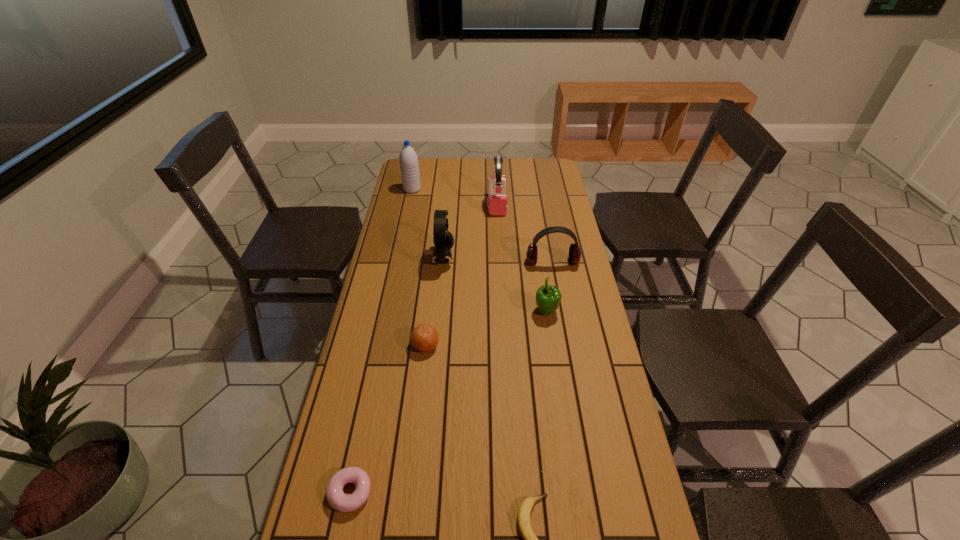
Image resolution: width=960 pixels, height=540 pixels. Identify the location of vacant area between the fourth nearest object and the second earphone from left to right. (521, 258).

Where is `vacant point located between the third nearest object and the leftmost earphone`? vacant point located between the third nearest object and the leftmost earphone is located at coordinates (434, 302).

The width and height of the screenshot is (960, 540). I want to click on the fifth closest object to the doughnut, so click(x=574, y=251).

Choose which object is the second nearest neighbor to the sixth farthest object. Please provide its 2D coordinates. Your answer should be formatted as a tuple, i.e. [(x, y)], where the tuple contains the x and y coordinates of a point satisfying the conditions above.

[(548, 297)]

Where is `the second closest earphone to the water bottle`? This screenshot has height=540, width=960. the second closest earphone to the water bottle is located at coordinates (443, 240).

Identify the location of earphone that is the second closest to the seventh tallest object. The height and width of the screenshot is (540, 960). (574, 251).

Find the location of a particular element. vacant area in the image that satisfies the following two spatial constraints: 1. on the outer surface of the farthest earphone; 2. on the ear cups of the leftmost earphone is located at coordinates click(x=500, y=259).

The width and height of the screenshot is (960, 540). Identify the location of vacant area in the image that satisfies the following two spatial constraints: 1. on the back side of the seventh tallest object; 2. on the right side of the fourth nearest object. (388, 312).